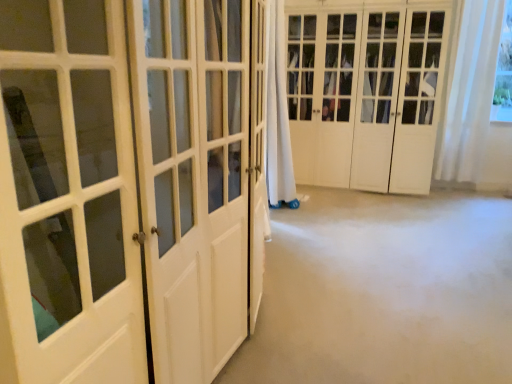
Question: Is white wood closet doors at center, the first door positioned from the back, taller or shorter than white glossy door at left, arranged as the first door when viewed from the front?

Choices:
 (A) tall
 (B) short

Answer: (A)

Question: Based on their positions, is white wood closet doors at center, the 2th door in the front-to-back sequence, located to the left or right of white glossy door at left, the 1th door when ordered from left to right?

Choices:
 (A) left
 (B) right

Answer: (B)

Question: Which of these objects is positioned closest to the white sheer curtain at upper right?

Choices:
 (A) white wood closet doors at center, the first door positioned from the back
 (B) white glossy door at left, which appears as the 2th door when viewed from the back

Answer: (A)

Question: Considering the real-world distances, which object is farthest from the white glossy door at left, the 2th door when ordered from right to left?

Choices:
 (A) white wood closet doors at center, the 2th door in the front-to-back sequence
 (B) white sheer curtain at upper right

Answer: (B)